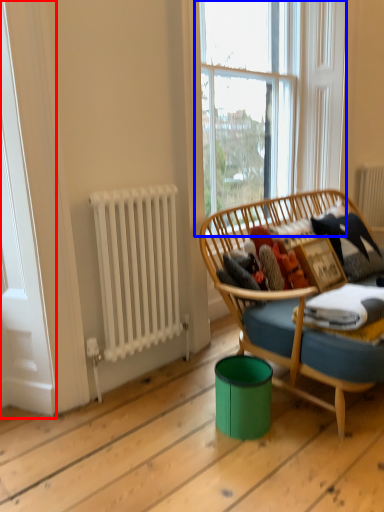
Question: Which point is further to the camera, screen door (highlighted by a red box) or window (highlighted by a blue box)?

Choices:
 (A) screen door
 (B) window

Answer: (B)